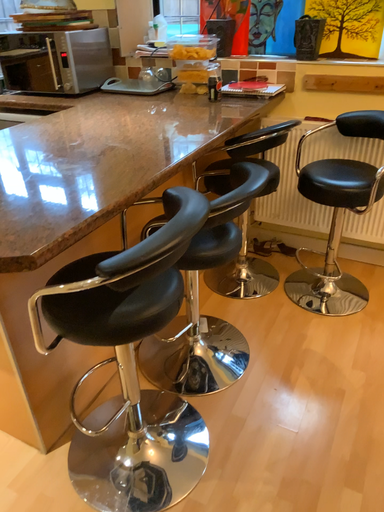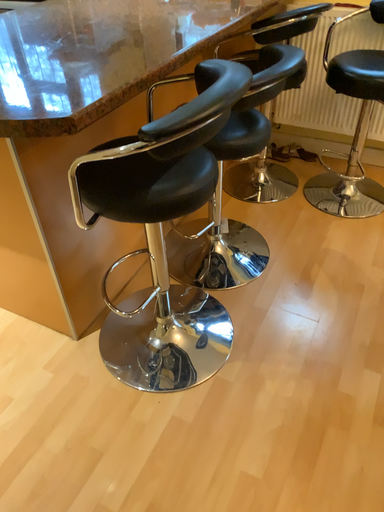
Question: How did the camera likely rotate when shooting the video?

Choices:
 (A) rotated downward
 (B) rotated upward

Answer: (A)